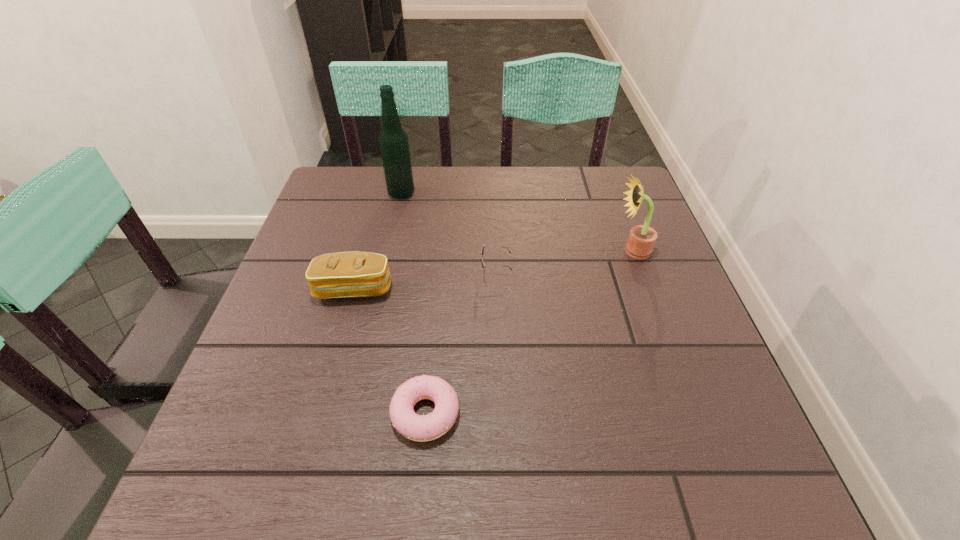
You are a GUI agent. You are given a task and a screenshot of the screen. Output one action in this format:
    pyautogui.click(x=<x>, y=<y>)
    Task: Click on the blank space that satisfies the following two spatial constraints: 1. on the zipper side of the clutch bag; 2. on the right side of the doughnut
    This screenshot has height=540, width=960.
    Given the screenshot: What is the action you would take?
    pyautogui.click(x=320, y=414)

The width and height of the screenshot is (960, 540). Find the location of `free space that satisfies the following two spatial constraints: 1. on the zipper side of the clutch bag; 2. on the left side of the doughnut`. free space that satisfies the following two spatial constraints: 1. on the zipper side of the clutch bag; 2. on the left side of the doughnut is located at coordinates (320, 414).

You are a GUI agent. You are given a task and a screenshot of the screen. Output one action in this format:
    pyautogui.click(x=<x>, y=<y>)
    Task: Click on the vacant area that satisfies the following two spatial constraints: 1. on the zipper side of the clutch bag; 2. on the left side of the third object from right to left
    The width and height of the screenshot is (960, 540).
    Given the screenshot: What is the action you would take?
    pyautogui.click(x=320, y=414)

You are a GUI agent. You are given a task and a screenshot of the screen. Output one action in this format:
    pyautogui.click(x=<x>, y=<y>)
    Task: Click on the vacant area that satisfies the following two spatial constraints: 1. on the face of the rightmost object; 2. on the front side of the nearest object
    
    Given the screenshot: What is the action you would take?
    pyautogui.click(x=692, y=414)